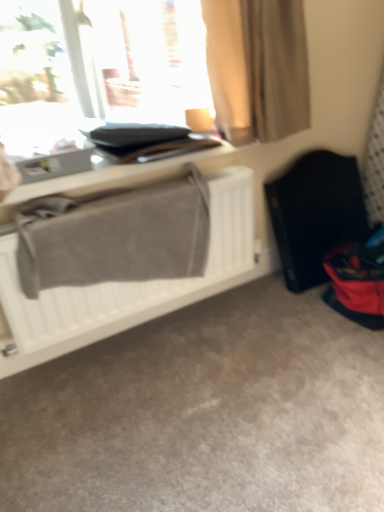
Question: Is matte gray table at upper left facing away from transparent glass window at upper left?

Choices:
 (A) no
 (B) yes

Answer: (B)

Question: Considering the relative positions of matte gray table at upper left and transparent glass window at upper left in the image provided, is matte gray table at upper left to the right of transparent glass window at upper left from the viewer's perspective?

Choices:
 (A) no
 (B) yes

Answer: (B)

Question: Can you confirm if matte gray table at upper left is bigger than transparent glass window at upper left?

Choices:
 (A) yes
 (B) no

Answer: (B)

Question: Considering the relative sizes of matte gray table at upper left and transparent glass window at upper left in the image provided, is matte gray table at upper left wider than transparent glass window at upper left?

Choices:
 (A) yes
 (B) no

Answer: (B)

Question: Considering the relative sizes of matte gray table at upper left and transparent glass window at upper left in the image provided, is matte gray table at upper left shorter than transparent glass window at upper left?

Choices:
 (A) yes
 (B) no

Answer: (A)

Question: Is matte gray table at upper left closer to camera compared to transparent glass window at upper left?

Choices:
 (A) yes
 (B) no

Answer: (B)

Question: From a real-world perspective, is black fabric folding chair at right physically below matte gray table at upper left?

Choices:
 (A) no
 (B) yes

Answer: (B)

Question: From a real-world perspective, is black fabric folding chair at right located higher than matte gray table at upper left?

Choices:
 (A) yes
 (B) no

Answer: (B)

Question: Can you confirm if black fabric folding chair at right is positioned to the right of matte gray table at upper left?

Choices:
 (A) no
 (B) yes

Answer: (B)

Question: Is black fabric folding chair at right closer to the viewer compared to matte gray table at upper left?

Choices:
 (A) no
 (B) yes

Answer: (A)

Question: Is black fabric folding chair at right thinner than matte gray table at upper left?

Choices:
 (A) no
 (B) yes

Answer: (B)

Question: Is the surface of black fabric folding chair at right in direct contact with matte gray table at upper left?

Choices:
 (A) no
 (B) yes

Answer: (A)

Question: Is transparent glass window at upper left wider than matte gray table at upper left?

Choices:
 (A) yes
 (B) no

Answer: (A)